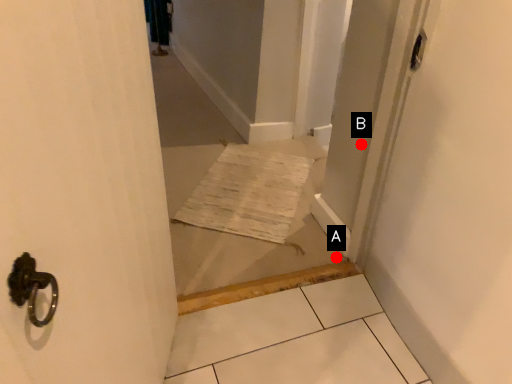
Question: Two points are circled on the image, labeled by A and B beside each circle. Which of the following is the farthest from the observer?

Choices:
 (A) A is further
 (B) B is further

Answer: (A)